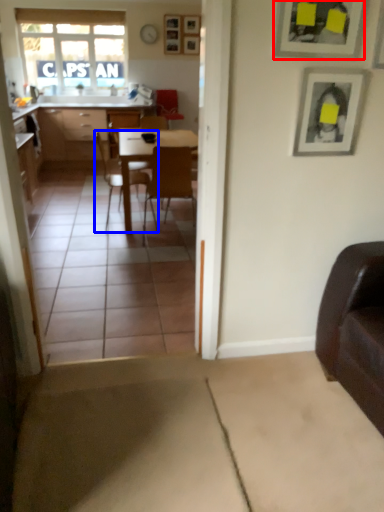
Question: Among these objects, which one is nearest to the camera, picture frame (highlighted by a red box) or chair (highlighted by a blue box)?

Choices:
 (A) picture frame
 (B) chair

Answer: (A)